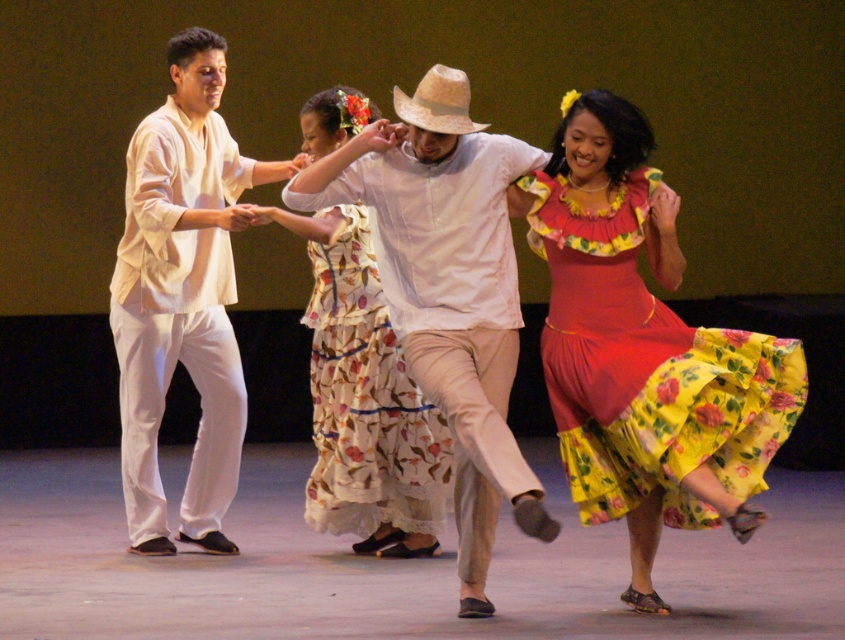
Question: Which is farther from the floral cotton dress at center?

Choices:
 (A) white cotton shirt at center
 (B) floral cotton dress at right

Answer: (B)

Question: Is white cotton shirt at center to the right of floral cotton dress at right from the viewer's perspective?

Choices:
 (A) no
 (B) yes

Answer: (A)

Question: Estimate the real-world distances between objects in this image. Which object is closer to the floral cotton dress at right?

Choices:
 (A) white cotton shirt at center
 (B) strawmaterial/texturecowboy hat at center
 (C) floral cotton dress at center

Answer: (A)

Question: Is white cotton shirt at center to the right of strawmaterial/texturecowboy hat at center from the viewer's perspective?

Choices:
 (A) yes
 (B) no

Answer: (A)

Question: Which is nearer to the matte white shirt at center?

Choices:
 (A) white cotton shirt at center
 (B) floral cotton dress at right
 (C) floral cotton dress at center

Answer: (C)

Question: Is floral cotton dress at right thinner than matte white shirt at center?

Choices:
 (A) yes
 (B) no

Answer: (B)